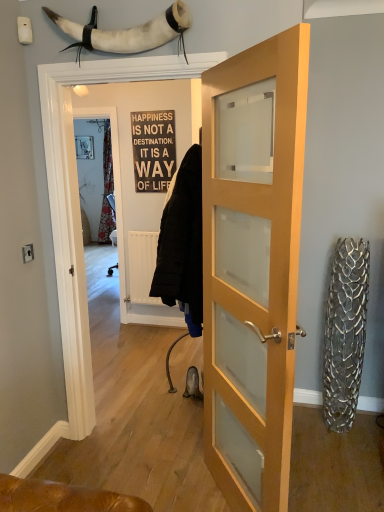
Identify the location of vacant area situated below white leather horn at upper center (from a real-world perspective). (132, 456).